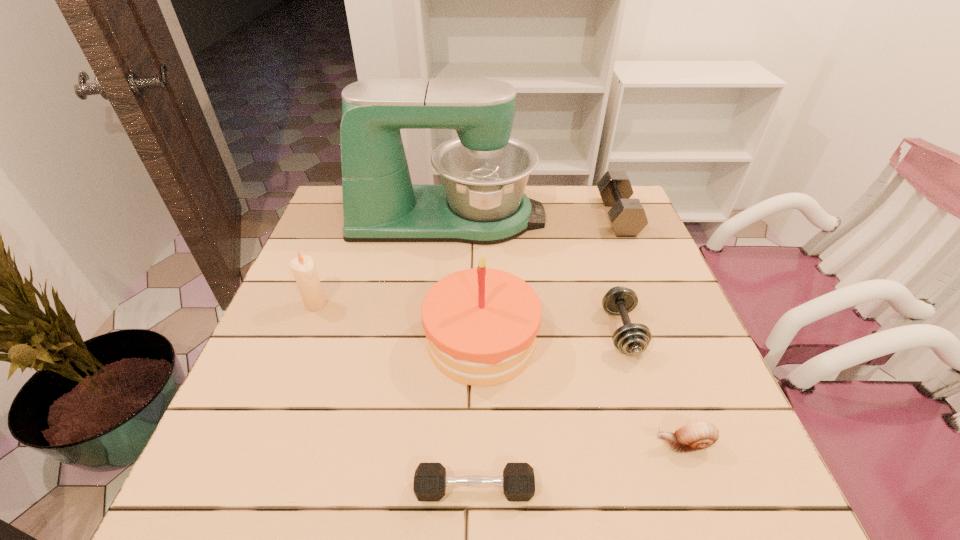
This screenshot has height=540, width=960. Identify the location of mixer. (484, 171).

The width and height of the screenshot is (960, 540). I want to click on birthday cake, so click(x=481, y=324).

Find the location of `candle`. candle is located at coordinates (303, 267).

Where is `the fourth shortest object`? the fourth shortest object is located at coordinates (627, 216).

This screenshot has height=540, width=960. Identify the location of the tallest dumbbell. (627, 216).

Locate an element on the screen. The image size is (960, 540). the second shortest dumbbell is located at coordinates (632, 338).

At what (x,y) coordinates should I click in order to perform the action: click on the second dumbbell from right to left. Please return your answer as a coordinate pair (x, y). This screenshot has width=960, height=540. Looking at the image, I should click on (632, 338).

The image size is (960, 540). I want to click on the second shortest object, so click(x=697, y=435).

Image resolution: width=960 pixels, height=540 pixels. What are the coordinates of `the sixth farthest object` in the screenshot? It's located at (697, 435).

What are the coordinates of `the leftmost dumbbell` in the screenshot? It's located at (430, 480).